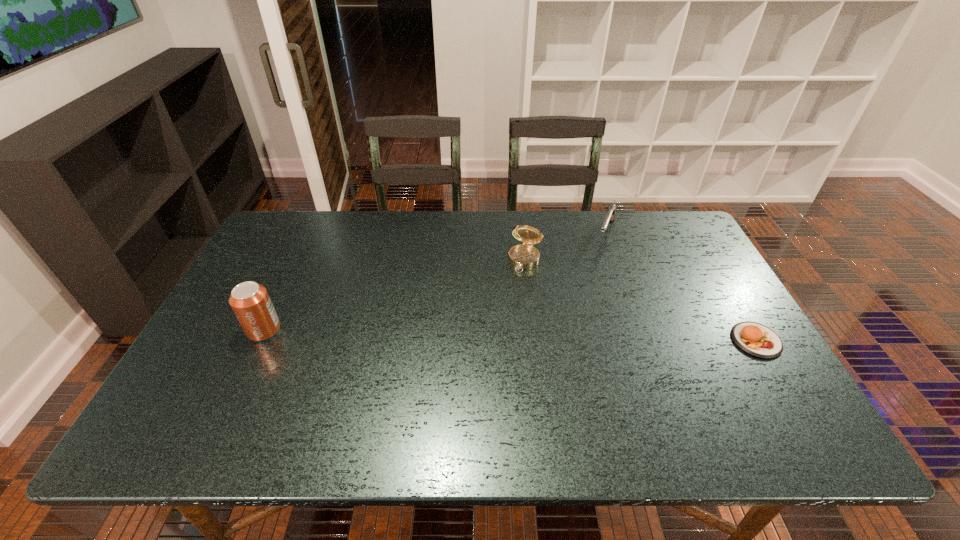
This screenshot has height=540, width=960. Find the location of `vacant area that lies between the third tallest object and the third object from right to left`. vacant area that lies between the third tallest object and the third object from right to left is located at coordinates (565, 247).

Identify the location of free space that is in between the patty (food) and the can. (510, 335).

Identify the location of vacant region between the rightmost object and the second object from left to right. (640, 300).

Where is `free space between the third shortest object and the second object from right to left`? Image resolution: width=960 pixels, height=540 pixels. free space between the third shortest object and the second object from right to left is located at coordinates pos(565,247).

At what (x,y) coordinates should I click in order to perform the action: click on free space between the leftmost object and the third shortest object. Please return your answer as a coordinate pair (x, y). This screenshot has width=960, height=540. Looking at the image, I should click on (395, 295).

The height and width of the screenshot is (540, 960). Find the location of `vacant point located between the gun and the leftmost object`. vacant point located between the gun and the leftmost object is located at coordinates (435, 281).

I want to click on the second closest object to the tallest object, so click(x=610, y=216).

Locate an element on the screen. This screenshot has width=960, height=540. object identified as the second closest to the compass is located at coordinates (758, 340).

The image size is (960, 540). I want to click on vacant space that satisfies the following two spatial constraints: 1. on the back side of the compass; 2. on the right side of the leftmost object, so click(298, 260).

What are the coordinates of `blank space that satisfies the following two spatial constraints: 1. on the front side of the tallest object; 2. on the left side of the patty (food)` in the screenshot? It's located at (259, 340).